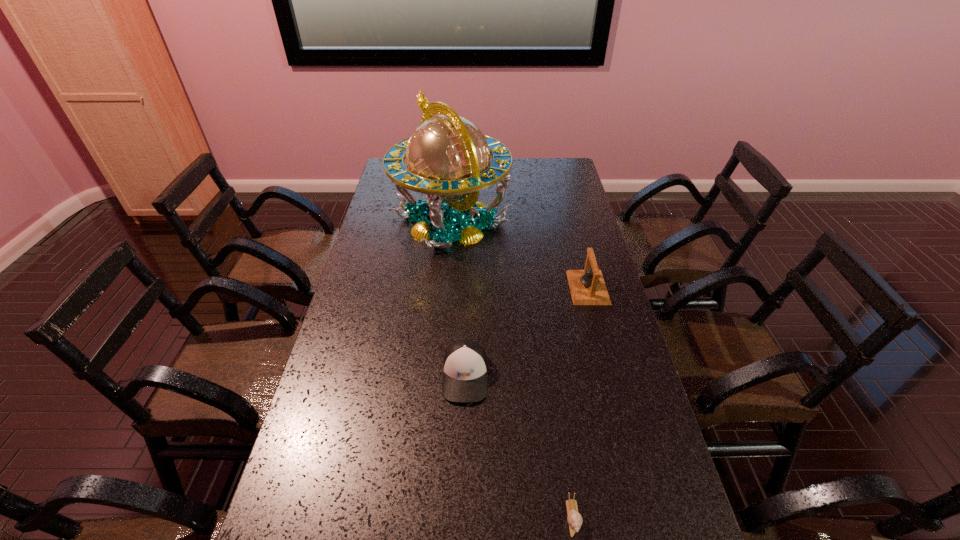
Image resolution: width=960 pixels, height=540 pixels. I want to click on vacant space that's between the third farthest object and the bell, so click(527, 332).

Locate an element on the screen. This screenshot has width=960, height=540. free space between the shortest object and the second farthest object is located at coordinates (580, 402).

What are the coordinates of `blank region between the globe and the second shortest object` in the screenshot? It's located at (458, 298).

Where is `free spot between the tallest object and the nearest object`? The width and height of the screenshot is (960, 540). free spot between the tallest object and the nearest object is located at coordinates (512, 369).

The width and height of the screenshot is (960, 540). Identify the location of vacant space in between the rightmost object and the escargot. (580, 402).

Locate an element on the screen. This screenshot has height=540, width=960. object that is the third closest one to the shortest object is located at coordinates (448, 158).

I want to click on object that stands as the third closest to the second shortest object, so click(448, 158).